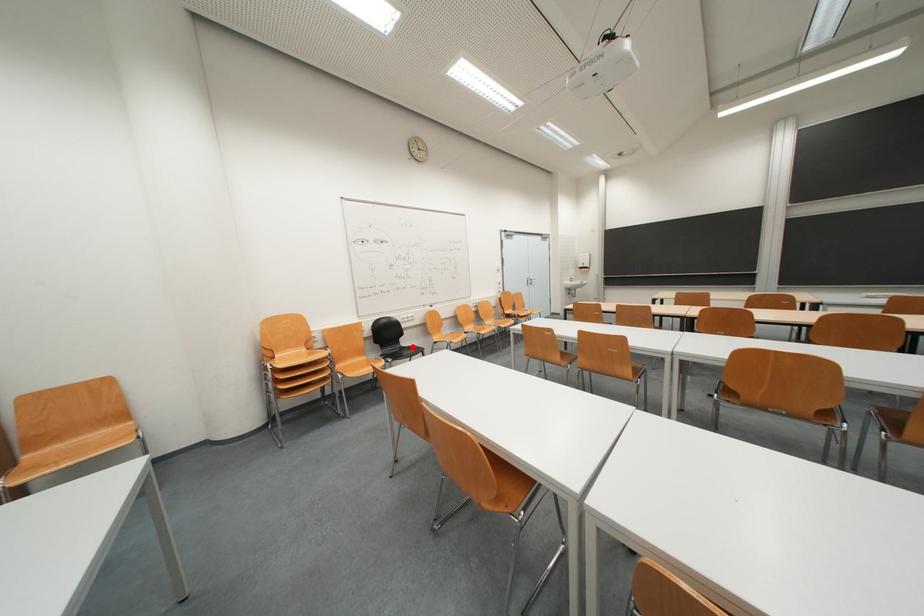
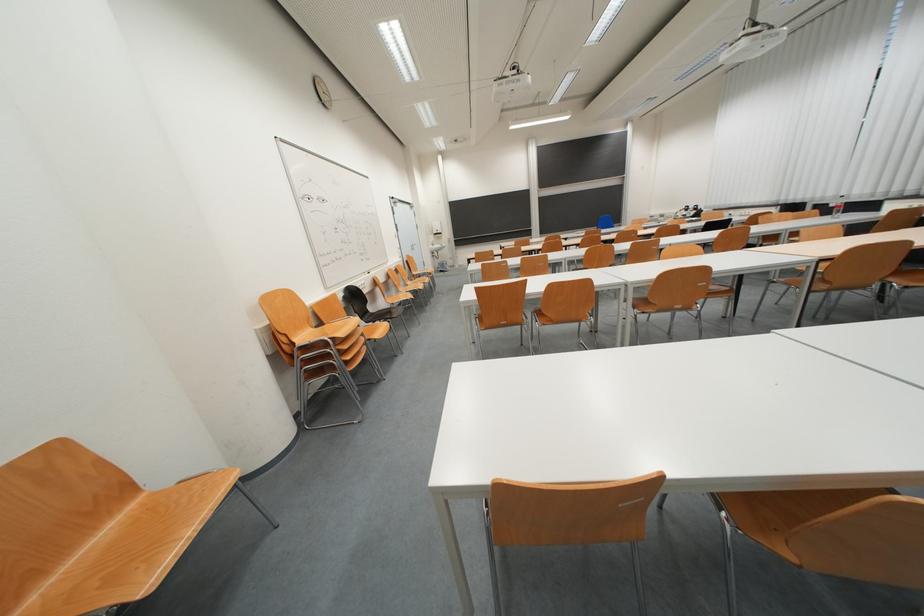
Question: I am providing you with two images of the same scene from different viewpoints. A red point is marked on the first image. Can you still see the location of the red point in image 2?

Choices:
 (A) Yes
 (B) No

Answer: (A)